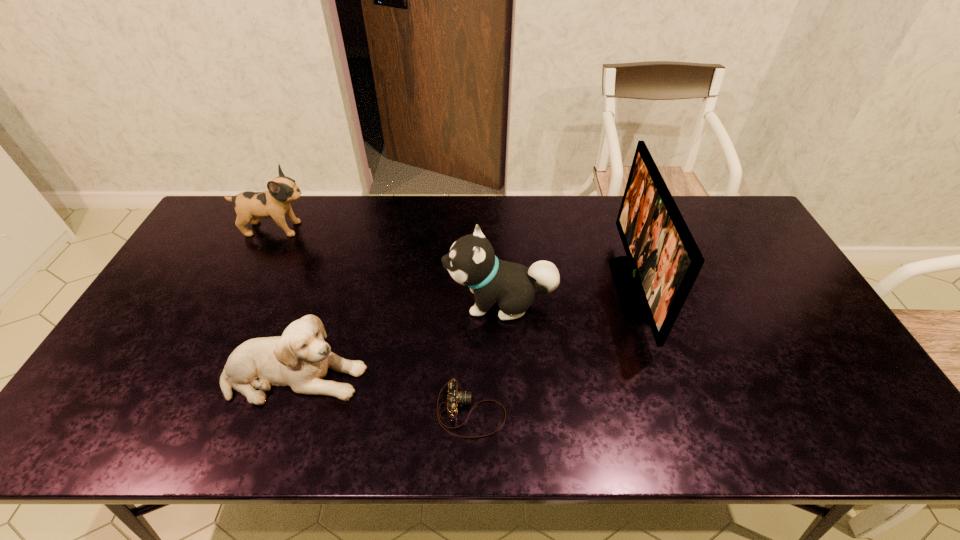
Find the location of a particular element. vacant area situated at the face of the second nearest puppy is located at coordinates (420, 302).

Locate an element on the screen. This screenshot has width=960, height=540. vacant area situated at the face of the second nearest puppy is located at coordinates (316, 302).

Where is `vacant area situated at the face of the second nearest puppy`? The width and height of the screenshot is (960, 540). vacant area situated at the face of the second nearest puppy is located at coordinates (414, 302).

At what (x,y) coordinates should I click in order to perform the action: click on vacant space located at the face of the farthest puppy. Please return your answer as a coordinate pair (x, y). Looking at the image, I should click on (421, 228).

Locate an element on the screen. The image size is (960, 540). free point located 0.250m on the front-facing side of the shortest puppy is located at coordinates (467, 376).

The width and height of the screenshot is (960, 540). In order to click on vacant point located 0.310m on the front-facing side of the shortest object in this screenshot , I will do `click(637, 411)`.

Identify the location of monitor that is at the far edge. (663, 260).

I want to click on puppy present at the far edge, so click(x=250, y=206).

Locate an element on the screen. object present at the near edge is located at coordinates (455, 397).

Where is `object that is at the left edge`? The height and width of the screenshot is (540, 960). object that is at the left edge is located at coordinates (250, 206).